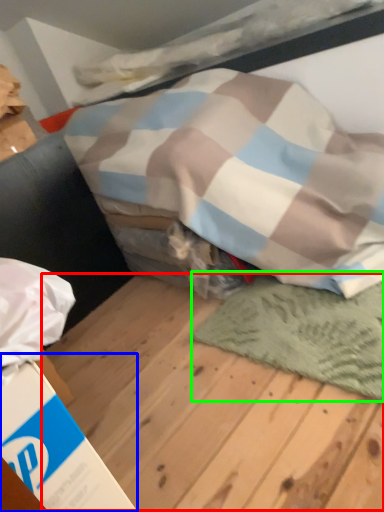
Question: Based on their relative distances, which object is farther from plywood (highlighted by a red box)? Choose from cardboard box (highlighted by a blue box) and mat (highlighted by a green box).

Choices:
 (A) cardboard box
 (B) mat

Answer: (A)